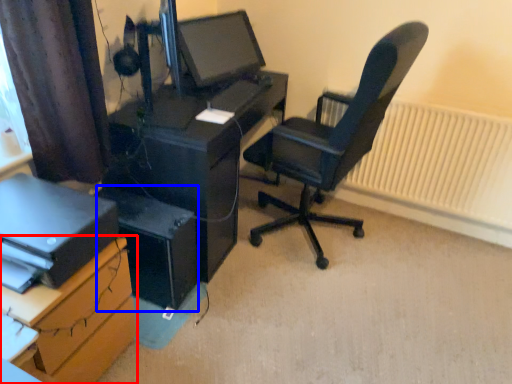
Question: Which object is closer to the camera taking this photo, desk (highlighted by a red box) or computer tower (highlighted by a blue box)?

Choices:
 (A) desk
 (B) computer tower

Answer: (A)